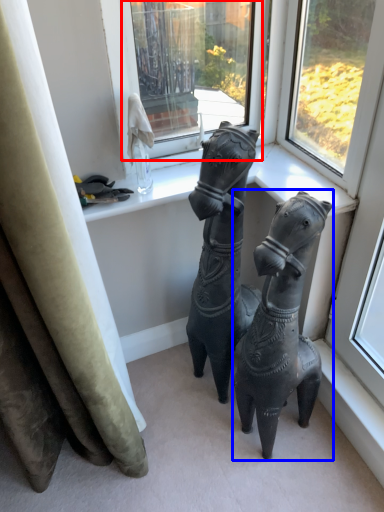
Question: Which object appears farthest to the camera in this image, window (highlighted by a red box) or horse (highlighted by a blue box)?

Choices:
 (A) window
 (B) horse

Answer: (A)